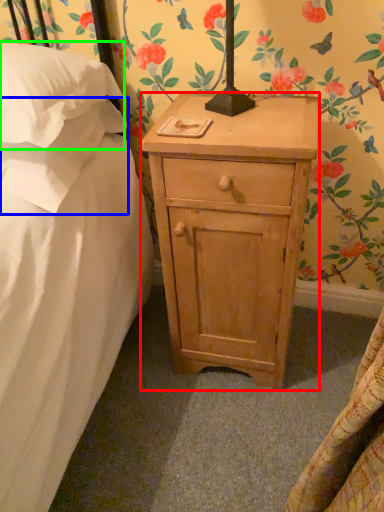
Question: Considering the real-world distances, which object is farthest from nightstand (highlighted by a red box)? pillow (highlighted by a blue box) or pillow (highlighted by a green box)?

Choices:
 (A) pillow
 (B) pillow

Answer: (B)